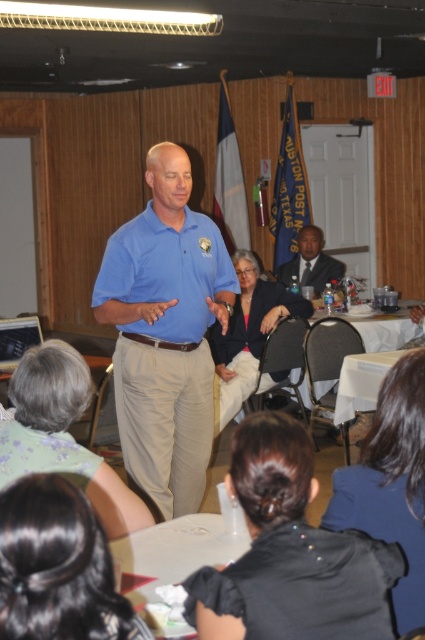
You are organizing a small event and need to ensure there is enough space between the matte blue shirt at center and the white plastic table at lower center for attendees to move comfortably. Based on the scene description, can you confirm if the space between them is sufficient?

The matte blue shirt at center is wider than the white plastic table at lower center, but since the shirt is a person wearing the shirt, the actual space between them would depend on their positioning. However, according to the description, the shirt is at center and the table is at lower center, suggesting they are positioned apart with space in between. The exact width comparison doesn

You are taking a photo of the speaker in the meeting room. There are two points marked in the image at coordinates point [187,262] and point [317,284]. Which point should you focus on to ensure the speaker is in sharp focus?

You should focus on point [187,262] because it is closer to the camera than point [317,284], ensuring the speaker is in sharp focus.